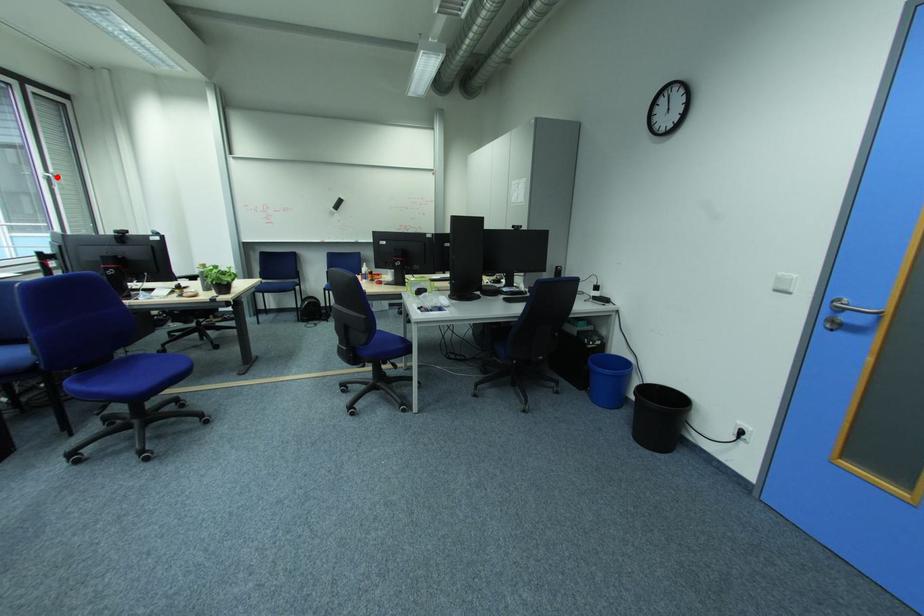
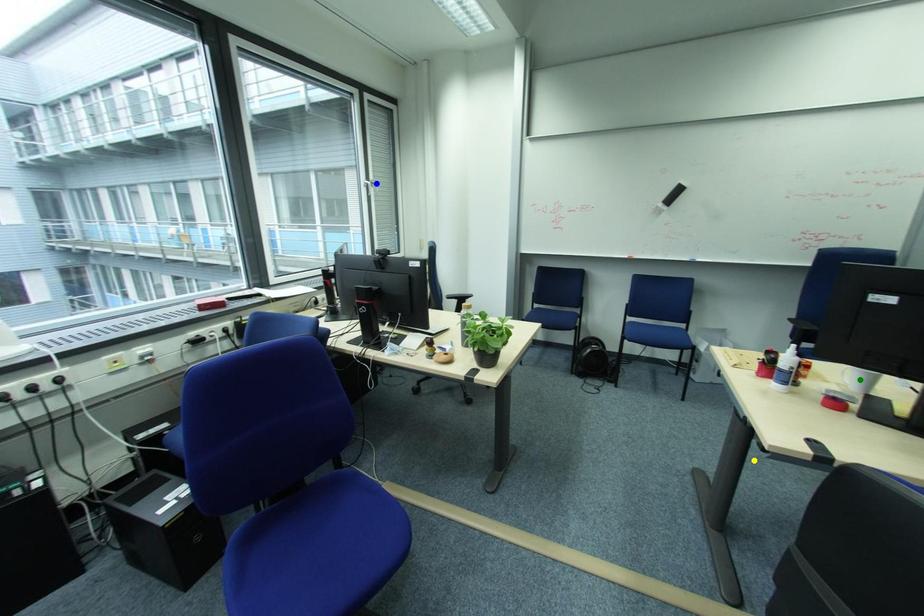
Question: I am providing you with two images of the same scene from different viewpoints. A red point is marked on the first image. You are given multiple points on the second image. Which point in image 2 is actually the same real-world point as the red point in image 1?

Choices:
 (A) blue point
 (B) yellow point
 (C) green point

Answer: (A)